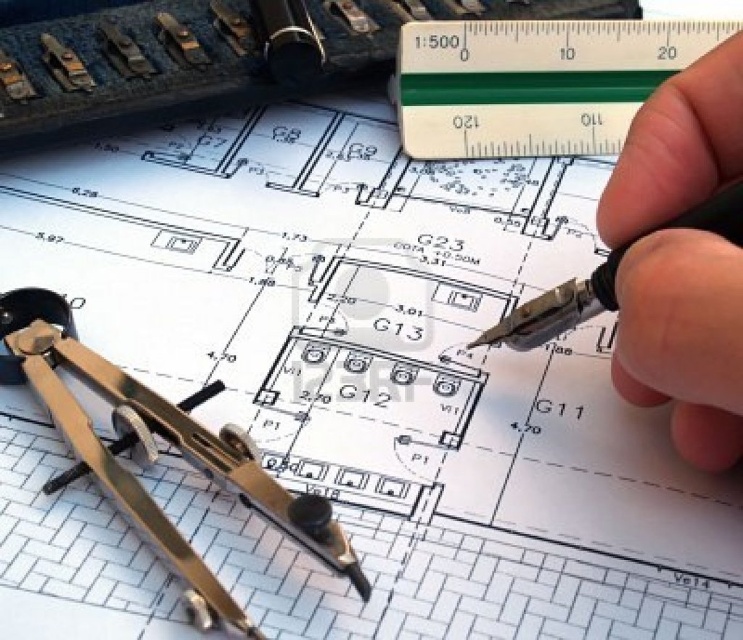
Question: Which of the following is the closest to the observer?

Choices:
 (A) (331, 554)
 (B) (611, 180)

Answer: (A)

Question: Observing the image, what is the correct spatial positioning of transparent plastic ruler at upper center in reference to metallic compass at lower left?

Choices:
 (A) above
 (B) below

Answer: (A)

Question: Based on their relative distances, which object is nearer to the metallic pen at center?

Choices:
 (A) black pen at upper right
 (B) metallic compass at lower left

Answer: (A)

Question: Does transparent plastic ruler at upper center appear under metallic pen at center?

Choices:
 (A) yes
 (B) no

Answer: (B)

Question: Which object is the farthest from the metallic compass at lower left?

Choices:
 (A) metallic pen at center
 (B) black pen at upper right

Answer: (B)

Question: Can you confirm if black pen at upper right is thinner than metallic compass at lower left?

Choices:
 (A) no
 (B) yes

Answer: (B)